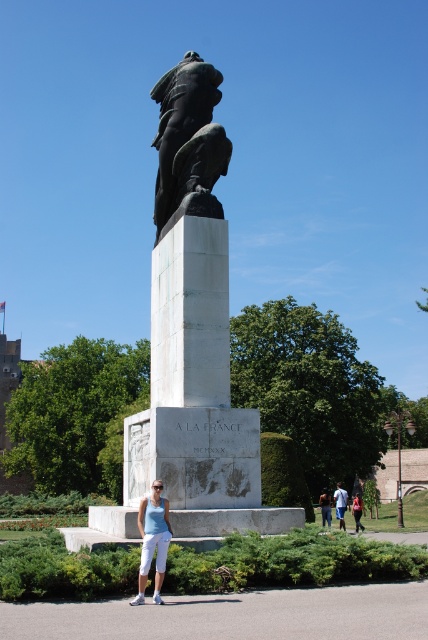
Who is positioned more to the left, black bronze eagle at upper center or blue denim jeans at lower center?

A: black bronze eagle at upper center is more to the left.

Is black bronze eagle at upper center thinner than blue denim jeans at lower center?

Indeed, black bronze eagle at upper center has a lesser width compared to blue denim jeans at lower center.

The height and width of the screenshot is (640, 428). I want to click on black bronze eagle at upper center, so click(x=187, y=144).

The width and height of the screenshot is (428, 640). I want to click on black bronze eagle at upper center, so click(187, 144).

Is black bronze eagle at upper center above matte white pants at center?

Correct, black bronze eagle at upper center is located above matte white pants at center.

Between point (205, 198) and point (142, 593), which one is positioned behind?

The point (205, 198) is more distant.

Find the location of a particular element. black bronze eagle at upper center is located at coordinates (187, 144).

Can you confirm if matte white pants at center is positioned to the left of blue denim jeans at lower center?

A: Yes, matte white pants at center is to the left of blue denim jeans at lower center.

Can you confirm if matte white pants at center is positioned above blue denim jeans at lower center?

Correct, matte white pants at center is located above blue denim jeans at lower center.

The height and width of the screenshot is (640, 428). Identify the location of matte white pants at center. (152, 540).

This screenshot has height=640, width=428. I want to click on matte white pants at center, so click(x=152, y=540).